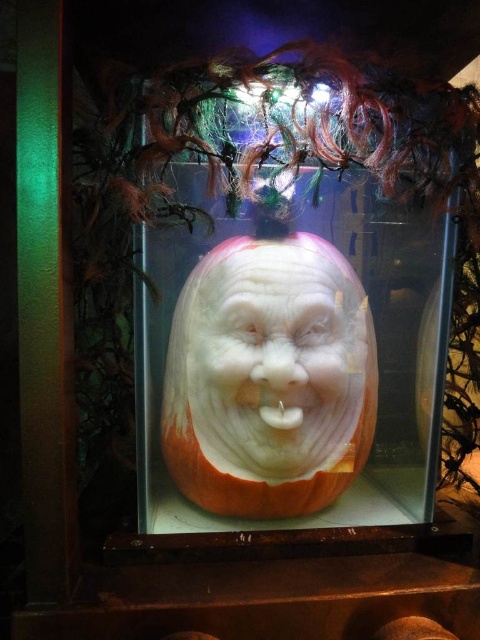
You are an artist trying to recreate the scene. You have both the transparent glass pumpkin at center and the white carved nose at center in front of you. Which object is taller?

The transparent glass pumpkin at center is taller than the white carved nose at center.

From the picture: You are a delivery person who needs to carefully transport the transparent glass pumpkin at center and the white carved nose at center in a box that is 12 inches wide. Can both items fit side by side in the box without overlapping?

The transparent glass pumpkin at center is 10.15 inches from the white carved nose at center, so yes, both items can fit side by side in the 12 inch wide box since the combined distance between them is less than the box width.